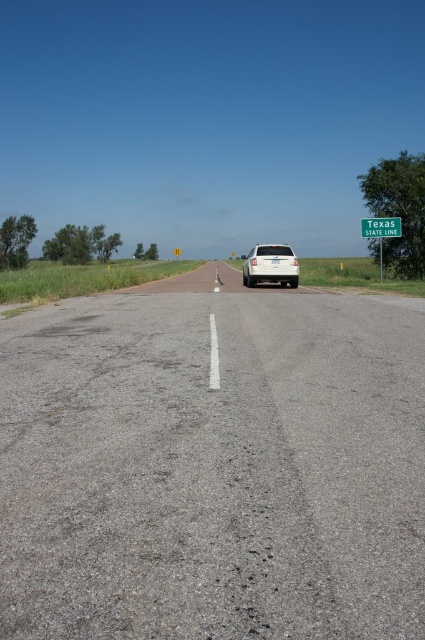
You are driving a car that is 18 inches wide. You see two signs, the green plastic sign at upper right and the green metallic sign at upper right, on the side of the road. Can your car fit between them while staying on the road?

The distance between the green plastic sign at upper right and the green metallic sign at upper right is 26.08 inches. Since your car is 18 inches wide, it can fit between them as the space is wider than the car.

You are standing at the point labeled point (271, 266) on the road. You want to walk to the green sign mounted on a metal post that reads Texas STATE LINE on the right side of the road. Which direction should you walk?

The point labeled point (271, 266) is on the white matte car at center. To reach the green sign mounted on a metal post that reads Texas STATE LINE on the right side of the road, you should walk to the right side of the road.

You are standing at the edge of the road near the Texas STATE LINE sign and want to walk to the white SUV. There are two points marked on the road surface at coordinates point (379, 243) and point (393, 228). Which point should you step on first if you want to reach the SUV as quickly as possible?

You should step on point (379, 243) first because it is closer to you than point (393, 228). Since point (379, 243) is further to the viewer, it is nearer in distance and would be the first point to reach on the path towards the SUV.